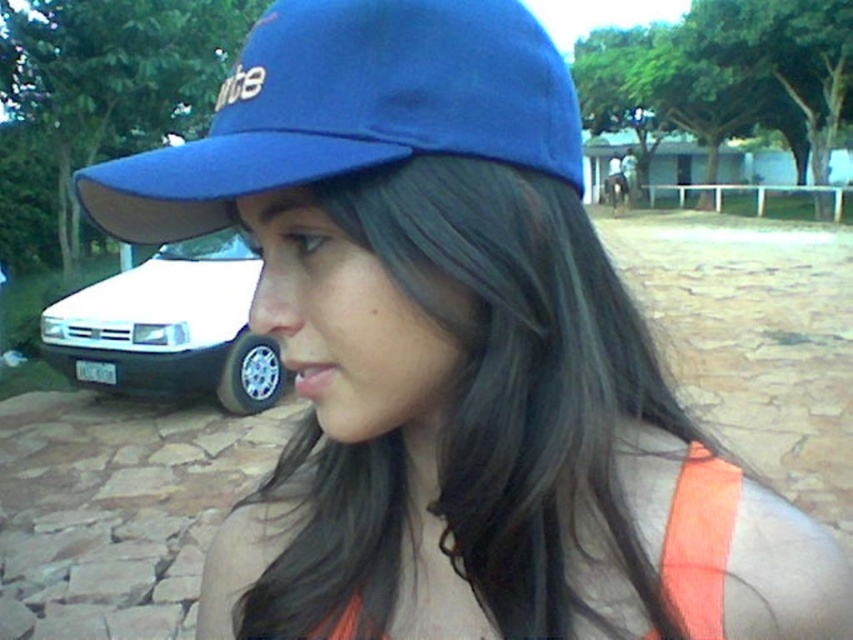
You are a delivery person who needs to park your bike between the white glossy car at left and the orange fabric safety vest at lower right. Which side should you place your bike closer to the vest to ensure enough space for your bike?

The white glossy car at left has a larger size compared to orange fabric safety vest at lower right, so you should place your bike closer to the orange fabric safety vest at lower right to ensure enough space between the two objects.

You are a delivery person who needs to place the orange fabric safety vest at lower right on top of the white glossy car at left. Is this possible based on the objects in the scene?

The white glossy car at left has a greater height compared to orange fabric safety vest at lower right. Therefore, placing the orange fabric safety vest at lower right on top of the white glossy car at left is possible since the car is taller than the vest.